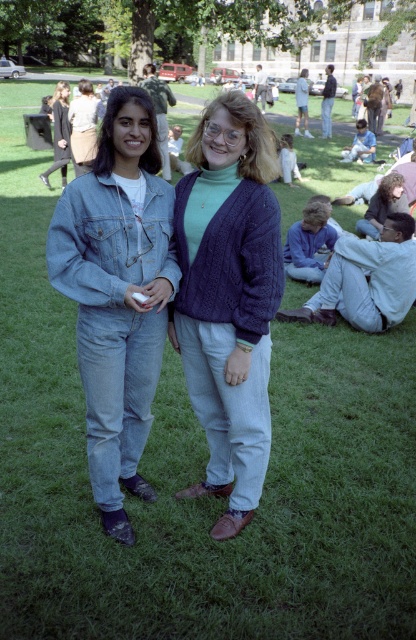
Question: Is denim jacket at center positioned before denim jumpsuit at left?

Choices:
 (A) yes
 (B) no

Answer: (A)

Question: Does knitted purple sweater at center appear over denim jumpsuit at left?

Choices:
 (A) yes
 (B) no

Answer: (B)

Question: Which point is closer to the camera taking this photo?

Choices:
 (A) pyautogui.click(x=66, y=115)
 (B) pyautogui.click(x=131, y=202)
 (C) pyautogui.click(x=242, y=214)

Answer: (C)

Question: Which point is closer to the camera taking this photo?

Choices:
 (A) (240, 156)
 (B) (170, 234)
 (C) (61, 129)

Answer: (A)

Question: From the image, what is the correct spatial relationship of knitted purple sweater at center in relation to denim jacket at center?

Choices:
 (A) above
 (B) below

Answer: (B)

Question: Considering the real-world distances, which object is closest to the denim jacket at center?

Choices:
 (A) knitted purple sweater at center
 (B) denim jumpsuit at left

Answer: (A)